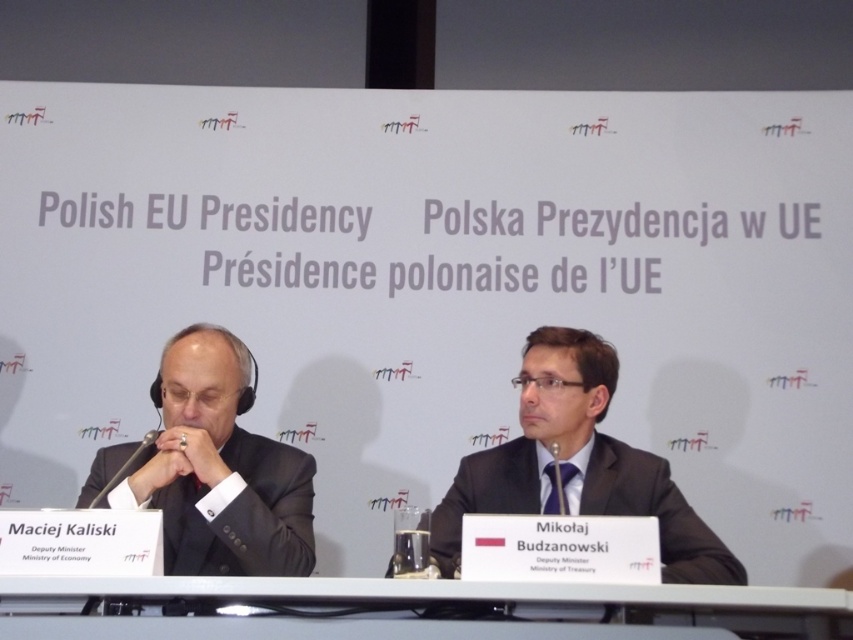
You are an event organizer who needs to adjust the seating arrangement for the press conference. The current setup has the matte black suit at center and the gray plastic table at center. If you want to place a nameplate between them, will there be enough space? The nameplate is 12 inches long.

The distance between the matte black suit at center and the gray plastic table at center is 22.85 inches. Since the nameplate is only 12 inches long, there is sufficient space to place it between them.

You are a photographer standing at the point marked by the coordinate point at (601, 512). You need to capture a photo of both individuals seated at the table in the foreground. Considering your position, will you be able to include both people in a single frame without moving? Please explain your reasoning based on their distance apart.

The two individuals are 2.58 meters apart. Since you are positioned at the coordinate point at (601, 512), which is likely near one of them, the distance between them may require adjusting your camera angle or zoom to fit both into the frame. However, without knowing the camera lens focal length or field of view, it is impossible to definitively determine if they can both be captured in a single frame.